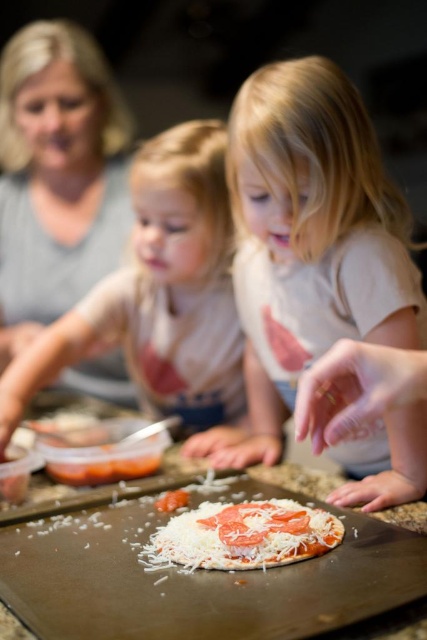
Question: Is white matte baking sheet at center positioned in front of white cheese pizza at center?

Choices:
 (A) yes
 (B) no

Answer: (A)

Question: Which point is closer to the camera taking this photo?

Choices:
 (A) (213, 630)
 (B) (277, 554)

Answer: (A)

Question: Which point is farther to the camera?

Choices:
 (A) (9, 634)
 (B) (28, 198)

Answer: (B)

Question: Which point is closer to the camera?

Choices:
 (A) white cotton shirt at center
 (B) white cheese pizza at center
 (C) white matte baking sheet at center

Answer: (C)

Question: Where is white matte pizza at center located in relation to white matte baking sheet at center in the image?

Choices:
 (A) left
 (B) right

Answer: (B)

Question: Does white matte pizza at center lie behind white cheese pizza at center?

Choices:
 (A) no
 (B) yes

Answer: (B)